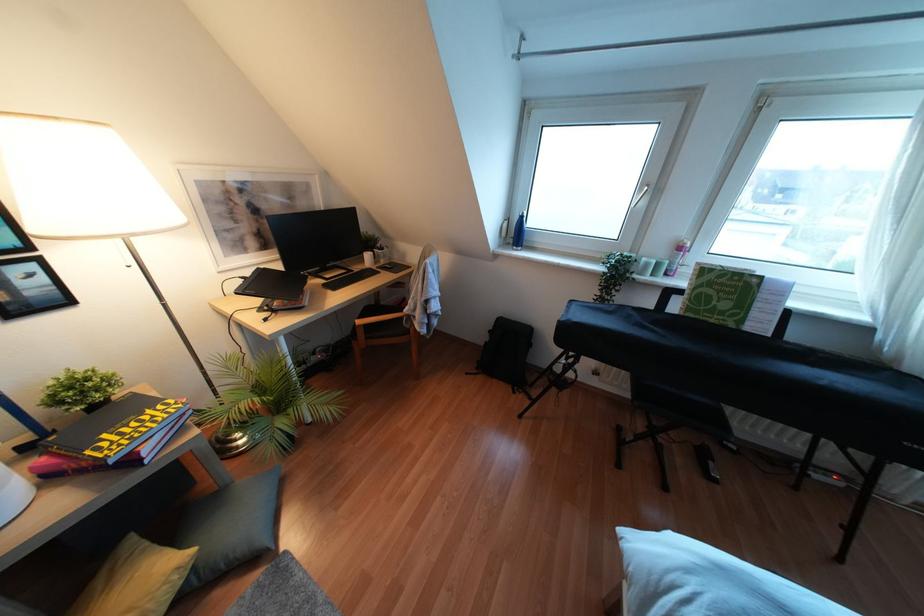
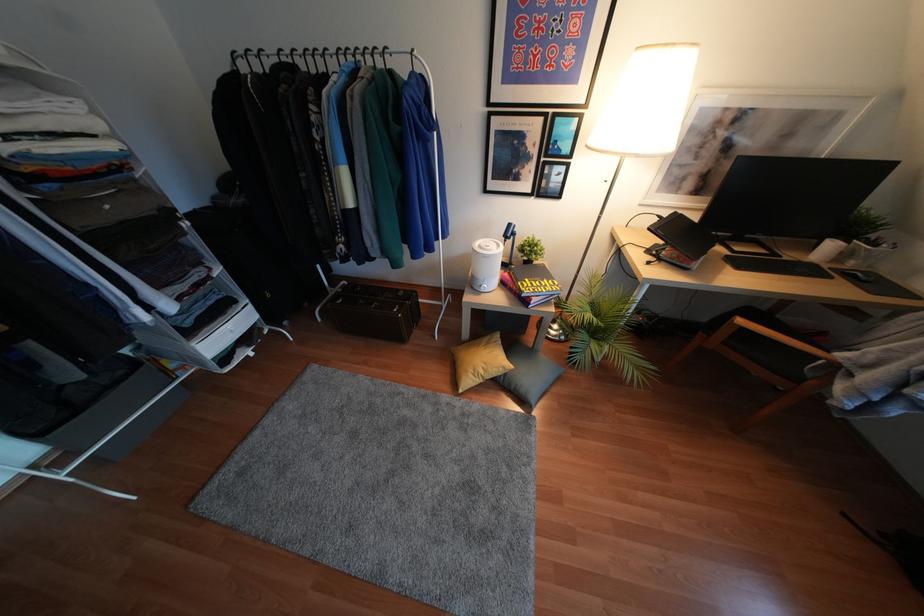
Locate, in the second image, the point that corresponds to [112,461] in the first image.

(523, 294)